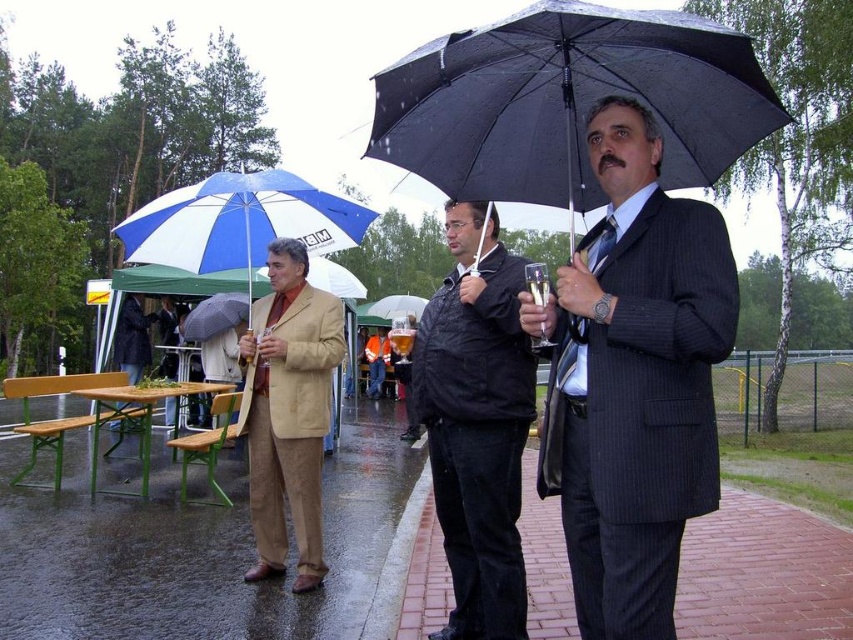
Question: Which object is positioned farthest from the black matte jacket at center?

Choices:
 (A) transparent plastic umbrella at center
 (B) gray matte umbrella at center
 (C) blue and white striped umbrella at left
 (D) beige fabric jacket at center

Answer: (A)

Question: Where is beige fabric jacket at center located in relation to blue and white striped umbrella at left in the image?

Choices:
 (A) right
 (B) left

Answer: (A)

Question: Among these objects, which one is nearest to the camera?

Choices:
 (A) gray matte umbrella at center
 (B) black matte jacket at center
 (C) black matte umbrella at center

Answer: (C)

Question: Is black matte jacket at center above beige fabric jacket at center?

Choices:
 (A) yes
 (B) no

Answer: (A)

Question: Does black matte umbrella at center appear on the right side of transparent plastic umbrella at center?

Choices:
 (A) no
 (B) yes

Answer: (B)

Question: Considering the real-world distances, which object is closest to the blue and white striped umbrella at left?

Choices:
 (A) gray matte umbrella at center
 (B) transparent plastic umbrella at center
 (C) black matte umbrella at center

Answer: (A)